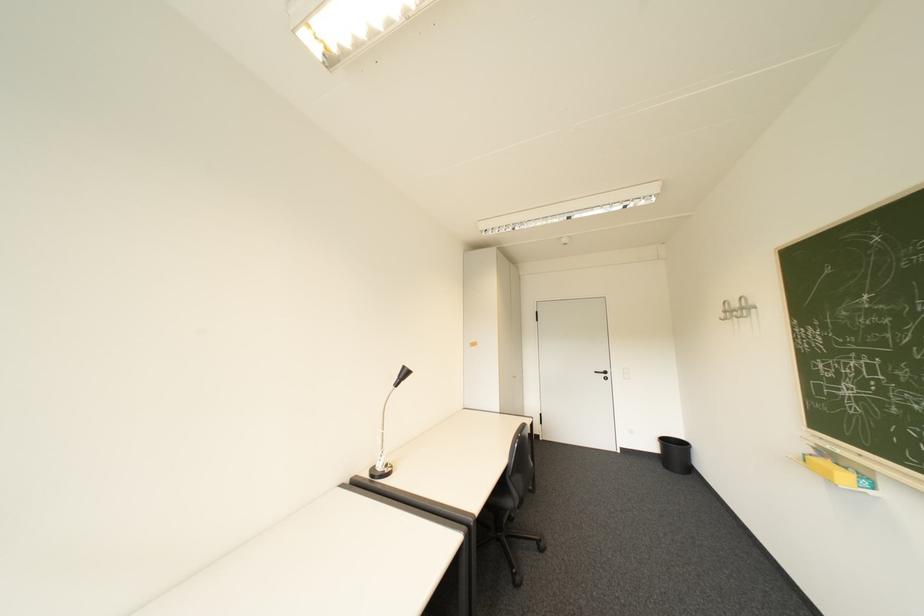
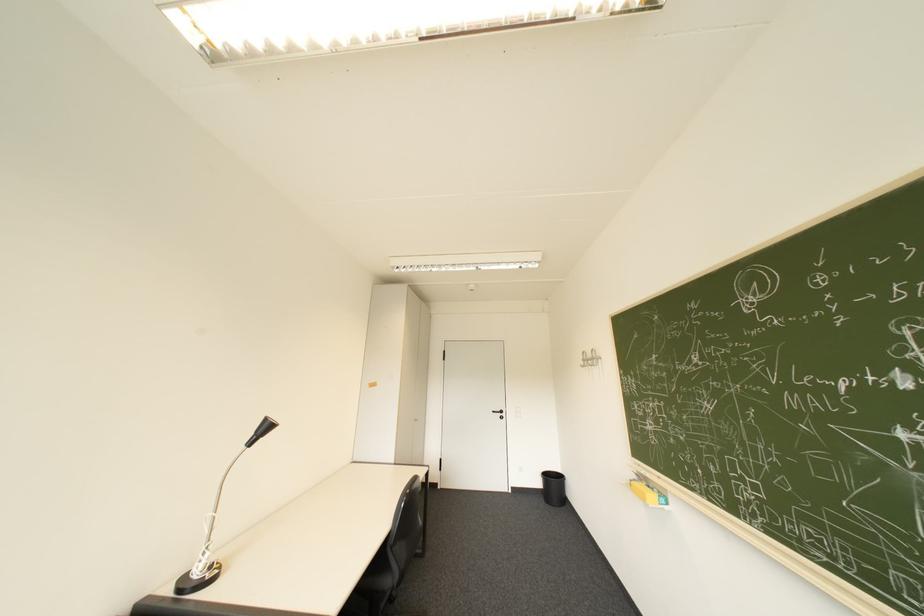
Where in the second image is the point corresponding to point 856,477 from the first image?

(662, 496)